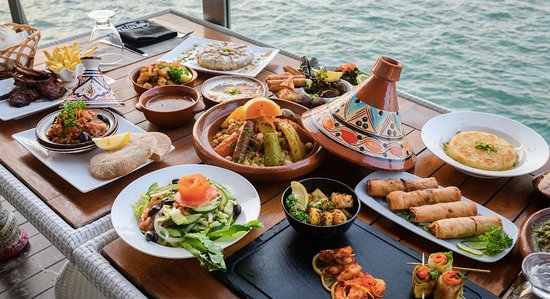
Where is `floor`? floor is located at coordinates pos(43,259).